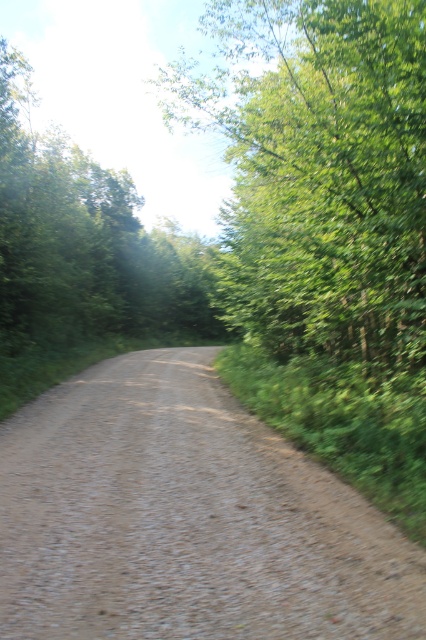
Question: Which is farther from the dirt/gravel road at center?

Choices:
 (A) green leafy tree at left
 (B) green leafy tree at upper center

Answer: (B)

Question: Which of the following is the closest to the observer?

Choices:
 (A) green leafy tree at left
 (B) dirt/gravel road at center
 (C) green leafy tree at upper center

Answer: (B)

Question: Which of the following is the closest to the observer?

Choices:
 (A) dirt/gravel road at center
 (B) green leafy tree at upper center
 (C) green leafy tree at left

Answer: (A)

Question: Is dirt/gravel road at center positioned before green leafy tree at upper center?

Choices:
 (A) no
 (B) yes

Answer: (B)

Question: Is dirt/gravel road at center positioned in front of green leafy tree at left?

Choices:
 (A) no
 (B) yes

Answer: (B)

Question: In this image, where is green leafy tree at upper center located relative to green leafy tree at left?

Choices:
 (A) left
 (B) right

Answer: (B)